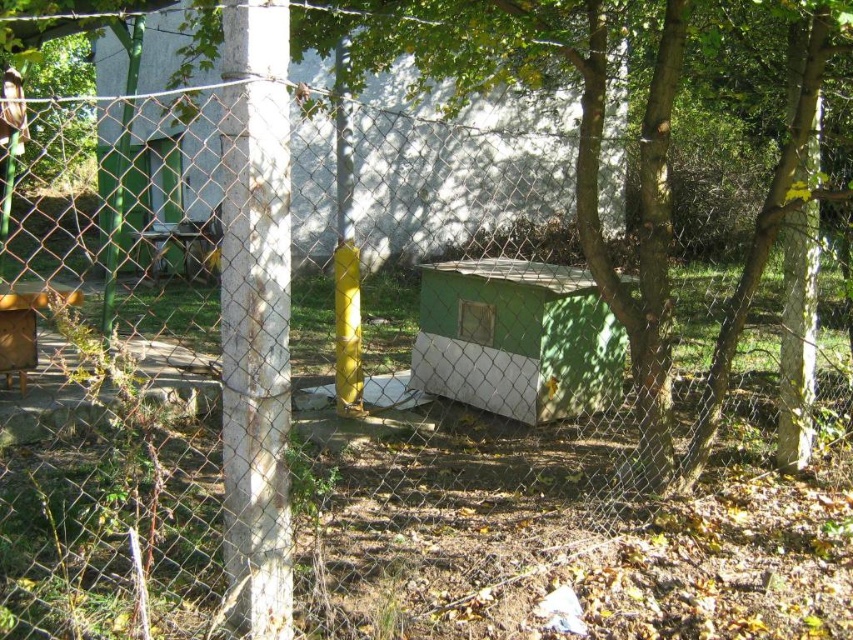
Question: Can you confirm if green matte/hard plastic hut at center is positioned above green matte/hardobject at center?

Choices:
 (A) no
 (B) yes

Answer: (B)

Question: Which point is farther to the camera?

Choices:
 (A) green matte/hard plastic hut at center
 (B) white concrete pole at center

Answer: (A)

Question: Is white concrete pole at center further to camera compared to green matte/hardobject at center?

Choices:
 (A) yes
 (B) no

Answer: (B)

Question: Which point is farther to the camera?

Choices:
 (A) (281, 243)
 (B) (426, 269)
 (C) (334, 221)

Answer: (C)

Question: Can you confirm if green matte/hard plastic hut at center is wider than white concrete pole at center?

Choices:
 (A) yes
 (B) no

Answer: (A)

Question: Which point is closer to the camera taking this photo?

Choices:
 (A) (328, 122)
 (B) (222, 240)

Answer: (B)